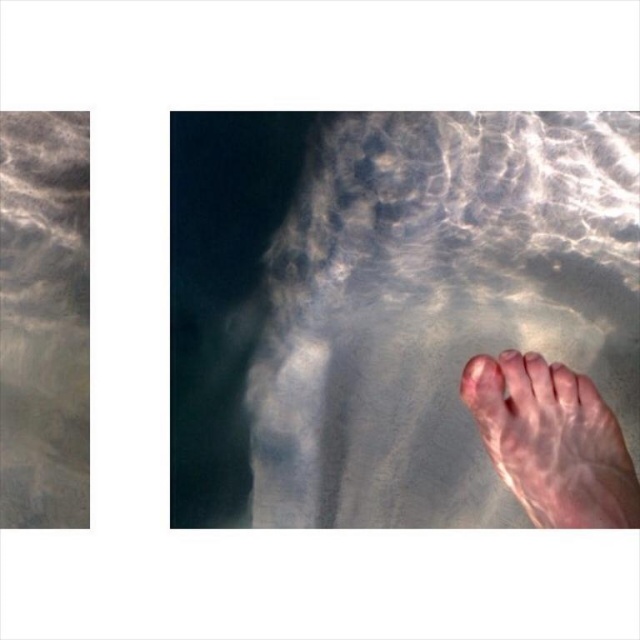
Question: Does pink flesh-toned foot at lower right appear on the right side of pink flesh at center?

Choices:
 (A) yes
 (B) no

Answer: (A)

Question: Does pink flesh-toned foot at lower right appear on the left side of pink flesh at center?

Choices:
 (A) no
 (B) yes

Answer: (A)

Question: Which object is closer to the camera taking this photo?

Choices:
 (A) pink flesh-toned foot at lower right
 (B) pink flesh at center

Answer: (A)

Question: Which point appears closest to the camera in this image?

Choices:
 (A) (552, 524)
 (B) (492, 406)

Answer: (A)

Question: Which of the following is the closest to the observer?

Choices:
 (A) pink flesh at center
 (B) pink flesh-toned foot at lower right

Answer: (B)

Question: Does pink flesh-toned foot at lower right appear on the left side of pink flesh at center?

Choices:
 (A) no
 (B) yes

Answer: (A)